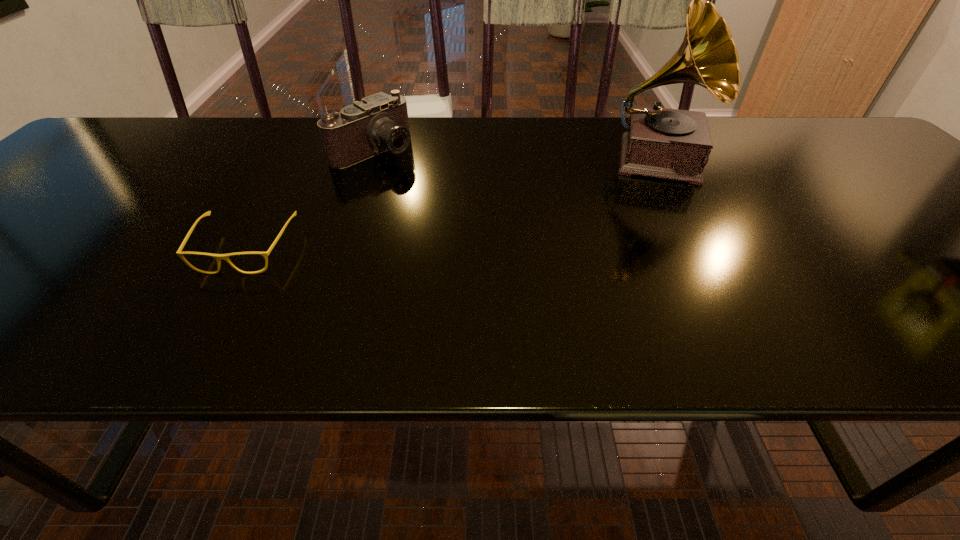
You are a GUI agent. You are given a task and a screenshot of the screen. Output one action in this format:
    pyautogui.click(x=<x>, y=<y>)
    Task: Click on the nearest object
    
    Given the screenshot: What is the action you would take?
    pyautogui.click(x=218, y=257)

You are a GUI agent. You are given a task and a screenshot of the screen. Output one action in this format:
    pyautogui.click(x=<x>, y=<y>)
    Task: Click on the shortest object
    This screenshot has width=960, height=540.
    Given the screenshot: What is the action you would take?
    pyautogui.click(x=218, y=257)

Locate an element on the screen. The width and height of the screenshot is (960, 540). camera is located at coordinates (364, 129).

Find the location of a particular element. This screenshot has width=960, height=540. the rightmost object is located at coordinates (674, 144).

What are the coordinates of `the tallest object` in the screenshot? It's located at (674, 144).

You are a GUI agent. You are given a task and a screenshot of the screen. Output one action in this format:
    pyautogui.click(x=<x>, y=<y>)
    Task: Click on the vacant space situated in front of the lenses of the nearest object
    
    Given the screenshot: What is the action you would take?
    pyautogui.click(x=214, y=304)

This screenshot has height=540, width=960. In order to click on blank area located 0.160m on the front-facing side of the camera in this screenshot , I will do `click(441, 190)`.

In order to click on vacant space located 0.330m on the front-facing side of the camera in this screenshot , I will do `click(492, 222)`.

At what (x,y) coordinates should I click in order to perform the action: click on vacant space located on the front-facing side of the camera. Please return your answer as a coordinate pair (x, y). The width and height of the screenshot is (960, 540). Looking at the image, I should click on (464, 204).

Where is `free space located 0.280m from the horn of the tallest object`? This screenshot has height=540, width=960. free space located 0.280m from the horn of the tallest object is located at coordinates click(x=670, y=280).